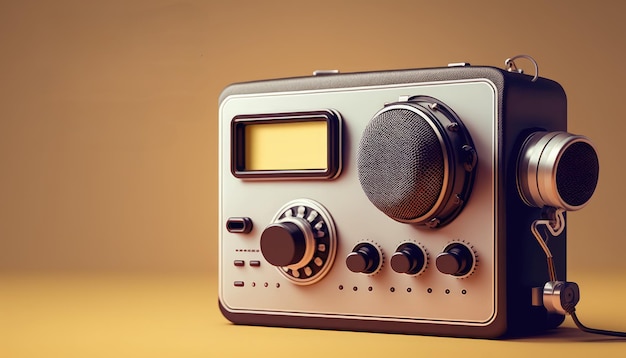
You are a GUI agent. You are given a task and a screenshot of the screen. Output one action in this format:
    pyautogui.click(x=<x>, y=<y>)
    Task: Click on the radio device
    Image resolution: width=626 pixels, height=358 pixels.
    Given the screenshot: What is the action you would take?
    pyautogui.click(x=326, y=207)